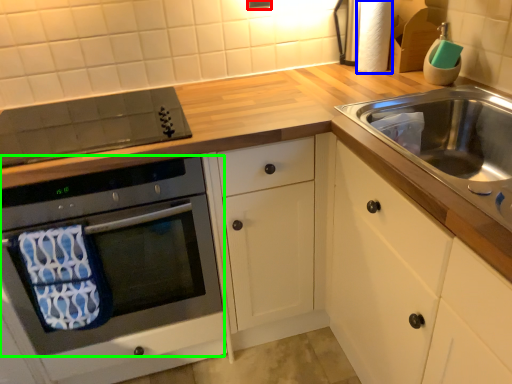
Question: Based on their relative distances, which object is farther from electric outlet (highlighted by a red box)? Choose from toilet paper (highlighted by a blue box) and oven (highlighted by a green box).

Choices:
 (A) toilet paper
 (B) oven

Answer: (B)